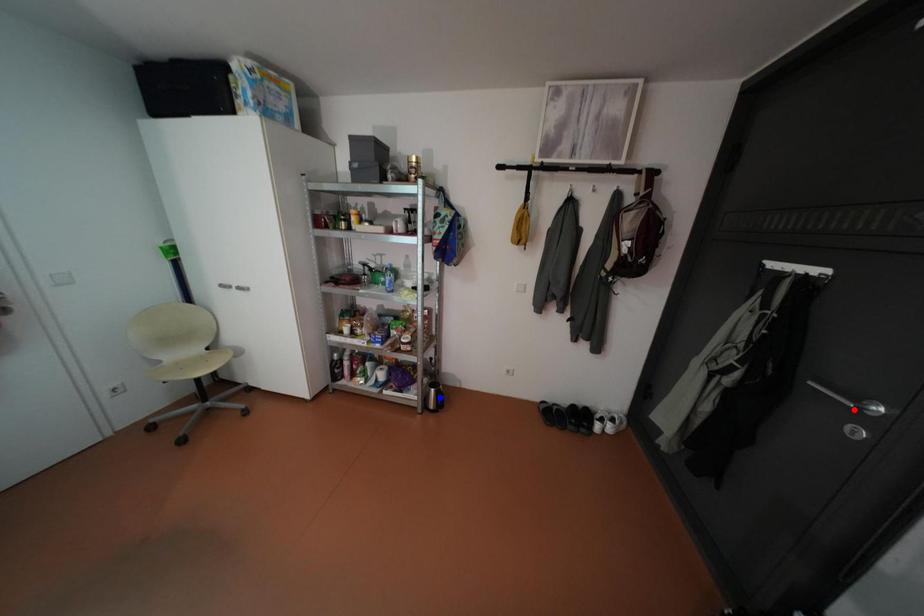
Question: In the image, two points are highlighted. Which point is nearer to the camera? Reply with the corresponding letter.

Choices:
 (A) blue point
 (B) red point

Answer: (B)